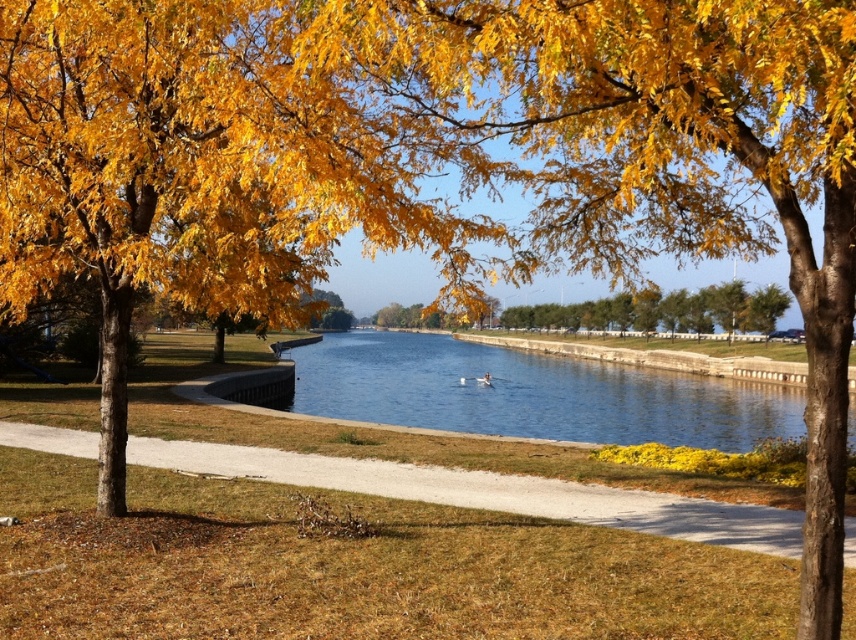
You are standing on the gravel path at center and want to reach the blue smooth water at center. Which direction should you move to get there?

You should move to your right because the blue smooth water at center is to the right of gravel path at center.

In the scene shown: You are standing on the pathway near the two trees and want to take a photo of the yellow leafy tree at center and the blue smooth water at center. Which object should you position lower in your camera frame?

You should position the blue smooth water at center lower in your camera frame because it is located below the yellow leafy tree at center.

You are standing on the gravel path at center and want to cross to the other side of the blue smooth water at center. Can you step directly across without needing to adjust your position?

The blue smooth water at center is taller than gravel path at center, so stepping directly across would not be possible since the water is elevated higher than the path.